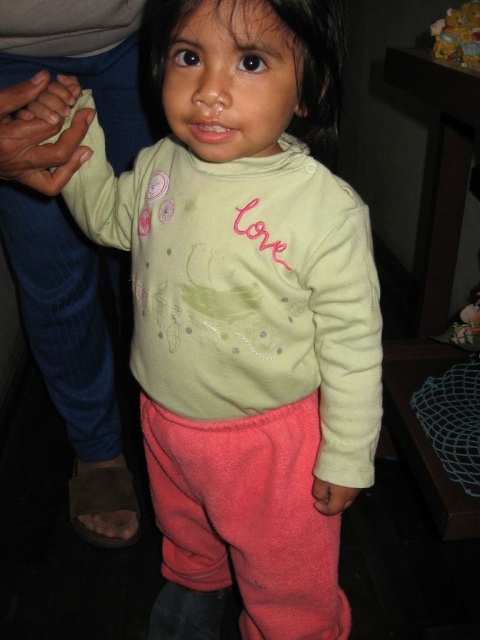
You are a photographer taking a picture of the child and the person holding their hand. To ensure both hands are visible in the frame, which hand should you focus on first, the matte yellow hand at left or the pink fabric hand at lower center?

The matte yellow hand at left is located above the pink fabric hand at lower center, so focusing on the matte yellow hand at left first would ensure both hands are visible in the frame since it is positioned higher up.